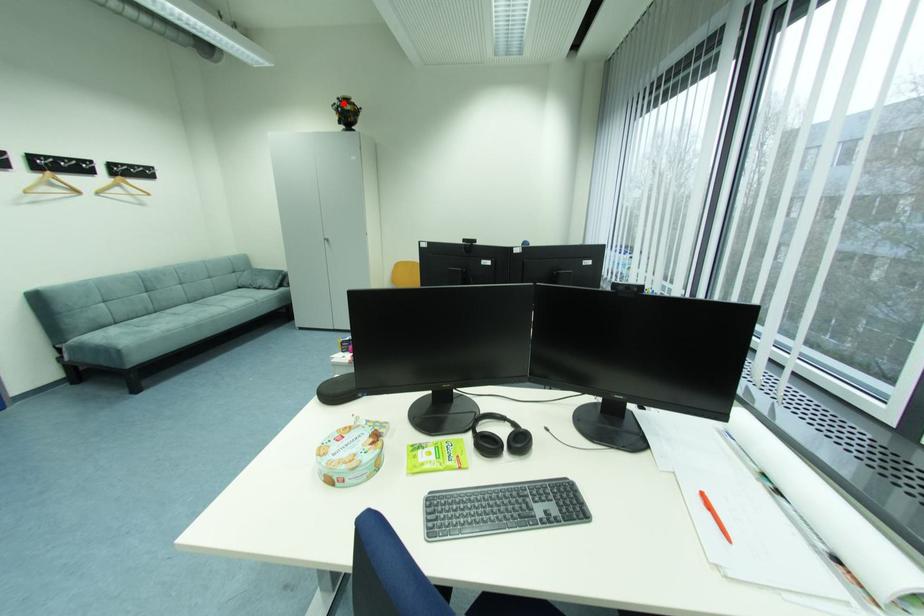
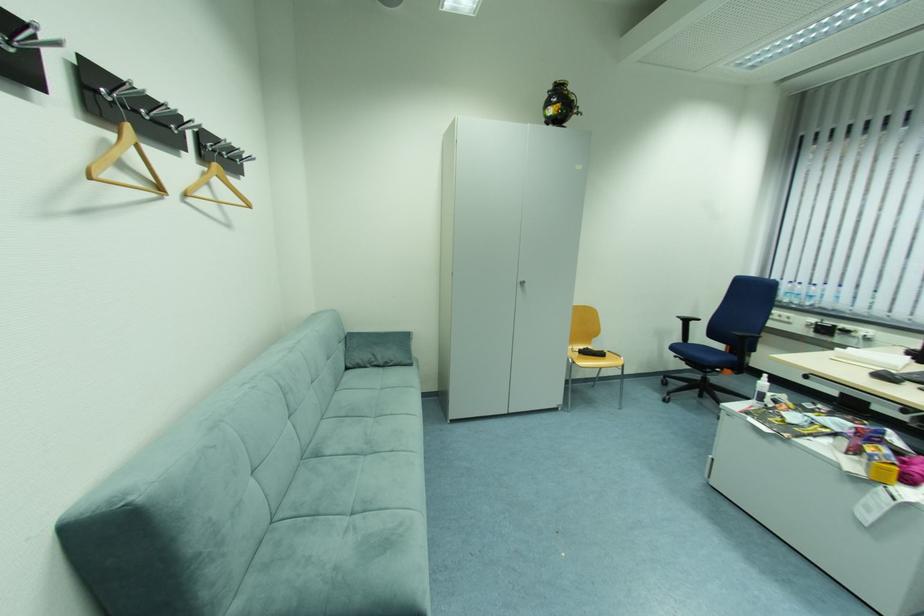
The point at the highlighted location is marked in the first image. Where is the corresponding point in the second image?

(558, 87)